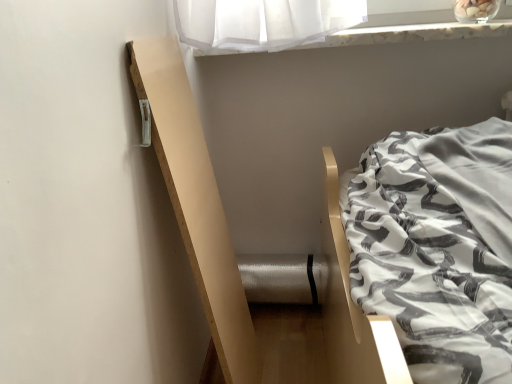
Question: Choose the correct answer: Is white marble window sill at upper center inside natural wood balustrade at left or outside it?

Choices:
 (A) outside
 (B) inside

Answer: (A)

Question: From their relative heights in the image, would you say white marble window sill at upper center is taller or shorter than natural wood balustrade at left?

Choices:
 (A) tall
 (B) short

Answer: (B)

Question: Is point (431, 34) closer or farther from the camera than point (186, 235)?

Choices:
 (A) farther
 (B) closer

Answer: (A)

Question: In the image, is natural wood balustrade at left positioned in front of or behind white marble window sill at upper center?

Choices:
 (A) front
 (B) behind

Answer: (A)

Question: Based on their sizes in the image, would you say natural wood balustrade at left is bigger or smaller than white marble window sill at upper center?

Choices:
 (A) big
 (B) small

Answer: (B)

Question: Visually, is natural wood balustrade at left positioned to the left or to the right of white marble window sill at upper center?

Choices:
 (A) left
 (B) right

Answer: (A)

Question: Would you say natural wood balustrade at left is inside or outside white marble window sill at upper center?

Choices:
 (A) inside
 (B) outside

Answer: (B)